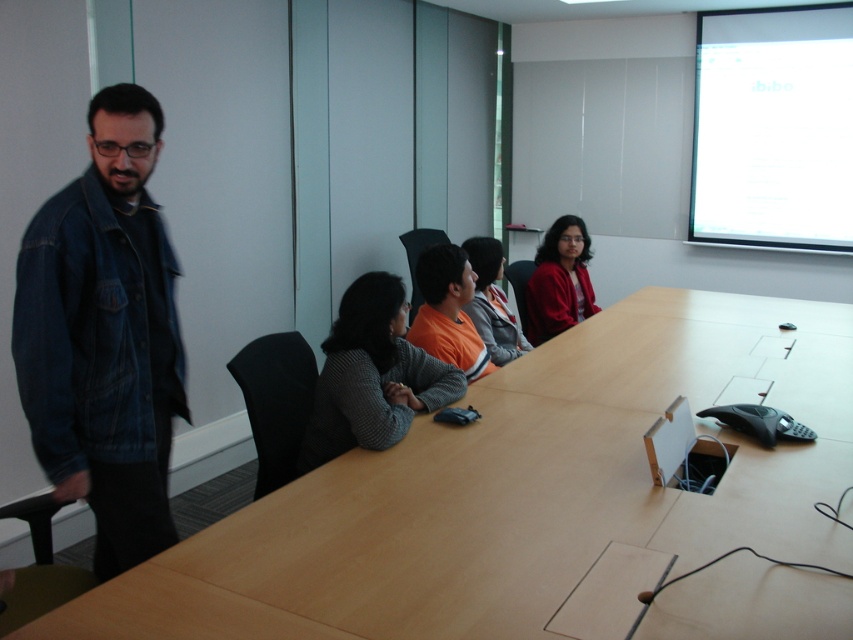
Image resolution: width=853 pixels, height=640 pixels. Describe the element at coordinates (372, 376) in the screenshot. I see `gray wool sweater at center` at that location.

Can you confirm if gray wool sweater at center is positioned to the right of orange cotton shirt at center?

In fact, gray wool sweater at center is to the left of orange cotton shirt at center.

The image size is (853, 640). In order to click on gray wool sweater at center in this screenshot , I will do `click(372, 376)`.

From the picture: Who is lower down, light brown wood table at center or denim jacket at left?

light brown wood table at center is lower down.

In the scene shown: Is light brown wood table at center above denim jacket at left?

No.

Who is more forward, (392, 625) or (123, 570)?

Positioned in front is point (392, 625).

Where is `light brown wood table at center`? The image size is (853, 640). light brown wood table at center is located at coordinates (515, 492).

Looking at this image, which is above, gray wool sweater at center or orange fleece jacket at center?

orange fleece jacket at center

Is point (378, 273) more distant than point (483, 339)?

That is False.

You are a GUI agent. You are given a task and a screenshot of the screen. Output one action in this format:
    pyautogui.click(x=<x>, y=<y>)
    Task: Click on the gray wool sweater at center
    This screenshot has width=853, height=640.
    Given the screenshot: What is the action you would take?
    pyautogui.click(x=372, y=376)